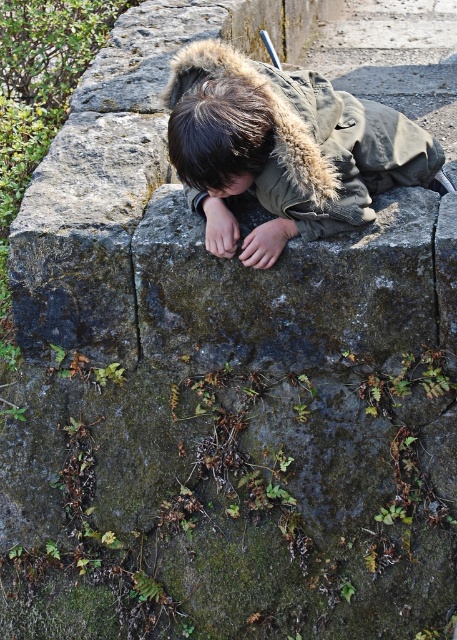
Question: Is khaki fleece-lined jacket at center further to camera compared to dark brown hair at center?

Choices:
 (A) no
 (B) yes

Answer: (B)

Question: Which of the following is the closest to the observer?

Choices:
 (A) dark brown hair at center
 (B) brown matte hair at center
 (C) khaki fleece-lined jacket at center

Answer: (A)

Question: Among these objects, which one is farthest from the camera?

Choices:
 (A) brown matte hair at center
 (B) dark brown hair at center

Answer: (A)

Question: Which point appears farthest from the camera in this image?

Choices:
 (A) (239, 186)
 (B) (255, 160)

Answer: (A)

Question: Is dark brown hair at center to the right of brown matte hair at center from the viewer's perspective?

Choices:
 (A) no
 (B) yes

Answer: (A)

Question: Can you confirm if dark brown hair at center is bigger than brown matte hair at center?

Choices:
 (A) yes
 (B) no

Answer: (A)